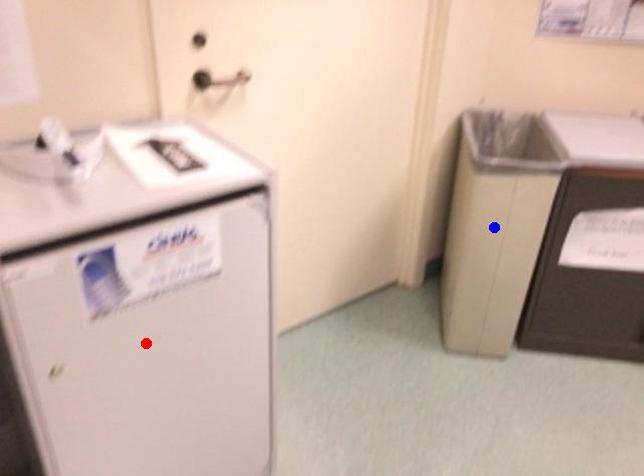
Question: In the image, two points are highlighted. Which point is nearer to the camera? Reply with the corresponding letter.

Choices:
 (A) blue point
 (B) red point

Answer: (B)